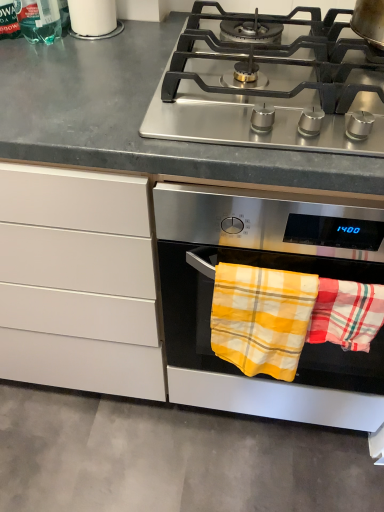
Question: Is white glossy cup at upper left wider or thinner than stainless steel oven at center?

Choices:
 (A) thin
 (B) wide

Answer: (A)

Question: From the image's perspective, is white glossy cup at upper left positioned above or below stainless steel oven at center?

Choices:
 (A) above
 (B) below

Answer: (A)

Question: Considering the real-world distances, which object is farthest from the stainless steel oven at center?

Choices:
 (A) stainless steel gas stove at upper center
 (B) yellow plaid towel at lower right, the second beach towel positioned from the left
 (C) stainless steel pot at upper right
 (D) yellow plaid towel at lower center, the 2th beach towel in the right-to-left sequence
 (E) translucent green bottle at upper left

Answer: (E)

Question: Which object is the closest to the yellow plaid towel at lower right, the 1th beach towel in the right-to-left sequence?

Choices:
 (A) stainless steel pot at upper right
 (B) yellow plaid towel at lower center, the first beach towel positioned from the left
 (C) translucent green bottle at upper left
 (D) white glossy cup at upper left
 (E) stainless steel gas stove at upper center

Answer: (B)